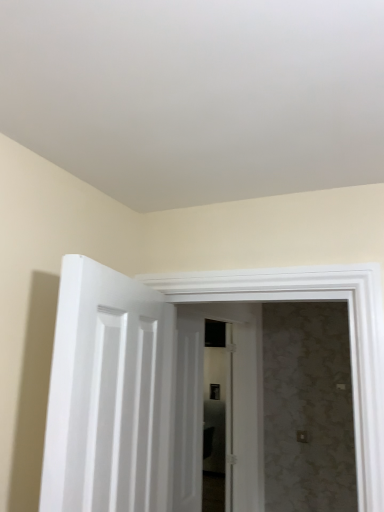
Question: From the image's perspective, is white painted wood door at left, positioned as the 1th door in front-to-back order, located beneath white wooden door at center, marked as the 2th door in a front-to-back arrangement?

Choices:
 (A) no
 (B) yes

Answer: (A)

Question: From the image's perspective, does white painted wood door at left, positioned as the 1th door in front-to-back order, appear higher than white wooden door at center, marked as the 2th door in a front-to-back arrangement?

Choices:
 (A) no
 (B) yes

Answer: (B)

Question: From a real-world perspective, is white painted wood door at left, positioned as the 1th door in front-to-back order, below white wooden door at center, the first door positioned from the back?

Choices:
 (A) yes
 (B) no

Answer: (B)

Question: Is white painted wood door at left, which is the 2th door in back-to-front order, completely or partially outside of white wooden door at center, marked as the 2th door in a front-to-back arrangement?

Choices:
 (A) yes
 (B) no

Answer: (A)

Question: Can you see white painted wood door at left, positioned as the 1th door in front-to-back order, touching white wooden door at center, marked as the 2th door in a front-to-back arrangement?

Choices:
 (A) yes
 (B) no

Answer: (B)

Question: Considering the relative sizes of white painted wood door at left, positioned as the 1th door in front-to-back order, and white wooden door at center, the first door positioned from the back, in the image provided, is white painted wood door at left, positioned as the 1th door in front-to-back order, shorter than white wooden door at center, the first door positioned from the back,?

Choices:
 (A) yes
 (B) no

Answer: (A)

Question: Is white wooden door at center, the first door positioned from the back, not close to white painted wood door at left, which is the 2th door in back-to-front order?

Choices:
 (A) no
 (B) yes

Answer: (B)

Question: Can you confirm if white wooden door at center, the first door positioned from the back, is thinner than white painted wood door at left, positioned as the 1th door in front-to-back order?

Choices:
 (A) no
 (B) yes

Answer: (A)

Question: Does white wooden door at center, the first door positioned from the back, have a greater height compared to white painted wood door at left, which is the 2th door in back-to-front order?

Choices:
 (A) yes
 (B) no

Answer: (A)

Question: Is the depth of white wooden door at center, marked as the 2th door in a front-to-back arrangement, greater than that of white painted wood door at left, positioned as the 1th door in front-to-back order?

Choices:
 (A) no
 (B) yes

Answer: (B)

Question: Considering the relative positions of white wooden door at center, marked as the 2th door in a front-to-back arrangement, and white painted wood door at left, positioned as the 1th door in front-to-back order, in the image provided, is white wooden door at center, marked as the 2th door in a front-to-back arrangement, in front of white painted wood door at left, positioned as the 1th door in front-to-back order,?

Choices:
 (A) no
 (B) yes

Answer: (A)

Question: Does white wooden door at center, the first door positioned from the back, have a larger size compared to white painted wood door at left, positioned as the 1th door in front-to-back order?

Choices:
 (A) yes
 (B) no

Answer: (A)

Question: Is point [192, 316] positioned closer to the camera than point [135, 290]?

Choices:
 (A) farther
 (B) closer

Answer: (A)